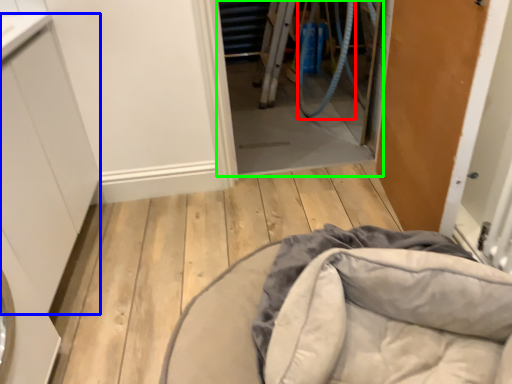
Question: Which is farther away from garden hose (highlighted by a red box)? cabinetry (highlighted by a blue box) or screen door (highlighted by a green box)?

Choices:
 (A) cabinetry
 (B) screen door

Answer: (A)